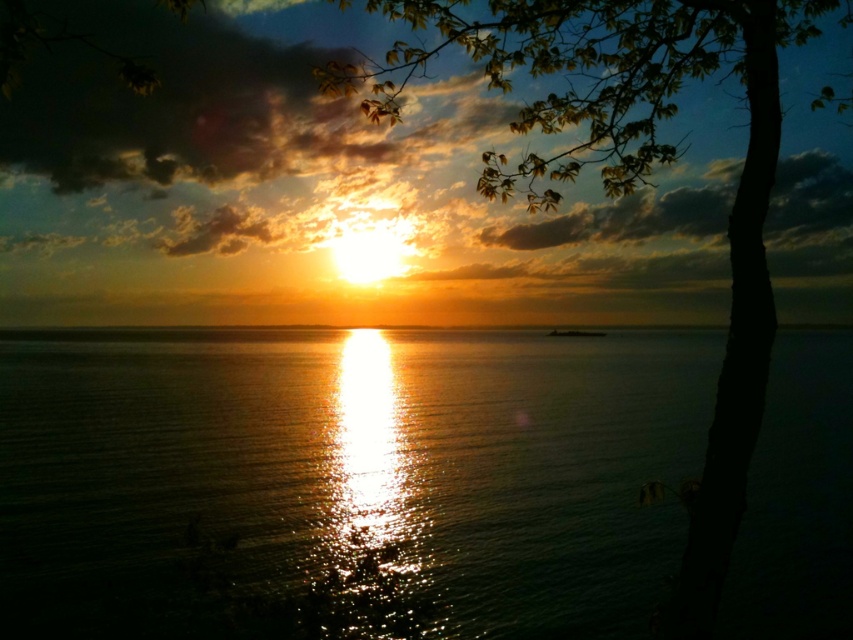
Who is lower down, shiny reflective water at center or green leafy tree at upper right?

shiny reflective water at center

Which is behind, point (32, 524) or point (764, 289)?

The point (32, 524) is behind.

Is point (645, 589) behind point (635, 161)?

Yes, point (645, 589) is farther from viewer.

Image resolution: width=853 pixels, height=640 pixels. I want to click on shiny reflective water at center, so pyautogui.click(x=347, y=470).